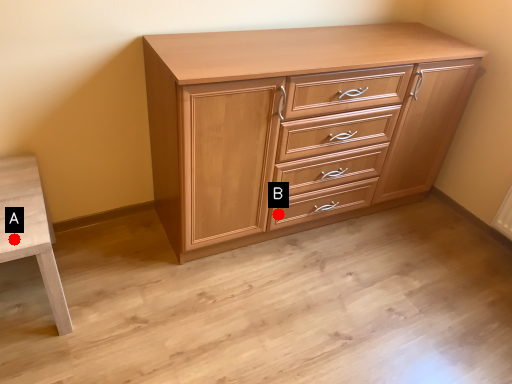
Question: Two points are circled on the image, labeled by A and B beside each circle. Which point is closer to the camera?

Choices:
 (A) A is closer
 (B) B is closer

Answer: (A)